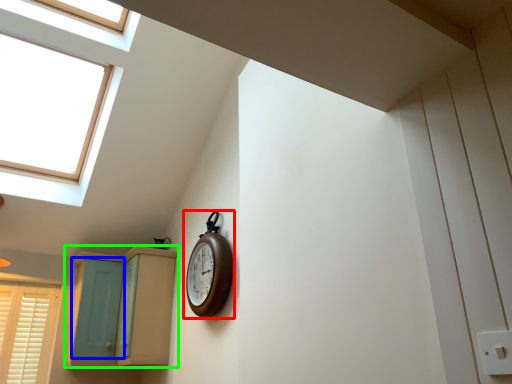
Question: Which object is the farthest from clock (highlighted by a red box)? Choose among these: screen door (highlighted by a blue box) or cabinetry (highlighted by a green box).

Choices:
 (A) screen door
 (B) cabinetry

Answer: (A)